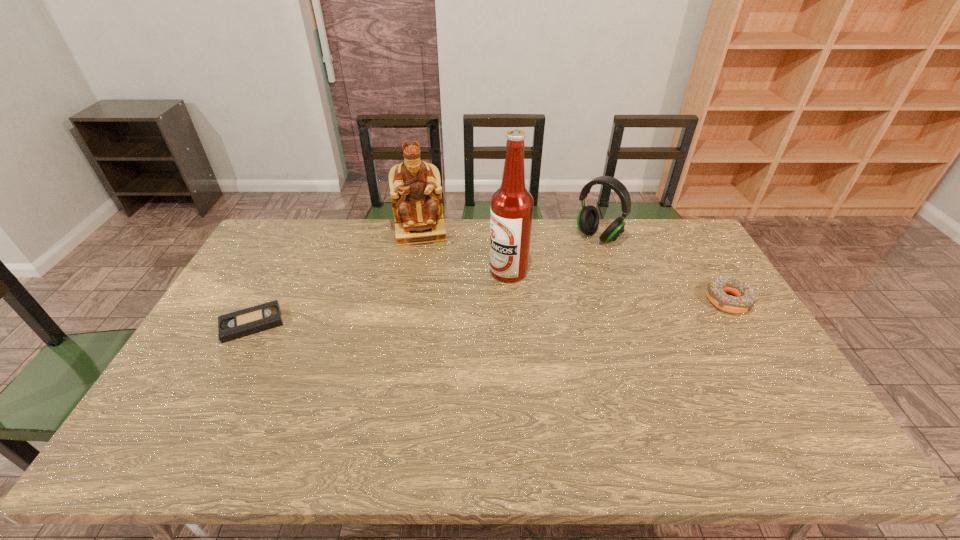
The image size is (960, 540). Identify the location of vacant area that lies between the videotape and the rightmost object. (490, 312).

Locate an element on the screen. vacant region between the alcohol and the second tallest object is located at coordinates (465, 252).

The image size is (960, 540). What are the coordinates of `free spot between the headset and the third object from right to left` in the screenshot? It's located at 553,254.

Where is `free space between the second tallest object and the alcohol`? The width and height of the screenshot is (960, 540). free space between the second tallest object and the alcohol is located at coordinates (465, 252).

Find the location of a particular element. The image size is (960, 540). free area in between the second object from right to left and the rightmost object is located at coordinates (662, 268).

At what (x,y) coordinates should I click in order to perform the action: click on vacant space that's between the third nearest object and the fourth tallest object. Please return your answer as a coordinate pair (x, y). Looking at the image, I should click on (618, 286).

What are the coordinates of `free space that is in between the second shortest object and the shortest object` in the screenshot? It's located at (490, 312).

Identify the location of free space between the doughnut and the tallest object. (618, 286).

At what (x,y) coordinates should I click in order to perform the action: click on unoccupied area between the alcohol and the second tallest object. Please return your answer as a coordinate pair (x, y). Looking at the image, I should click on (465, 252).

Find the location of a particular element. The width and height of the screenshot is (960, 540). object that stands as the fourth closest to the videotape is located at coordinates (745, 298).